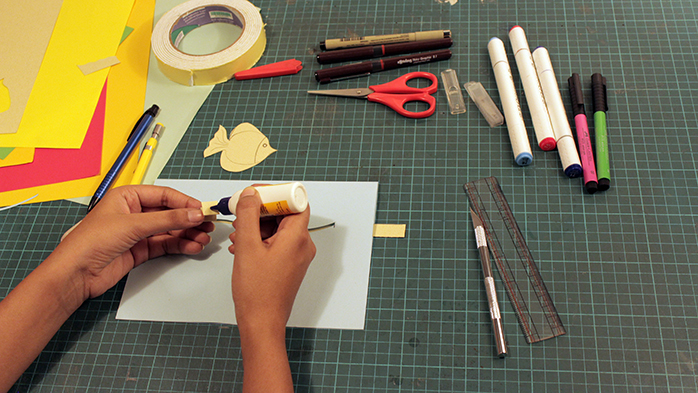
The image size is (698, 393). What are the coordinates of `place to hold the scissors` in the screenshot? It's located at (393, 95).